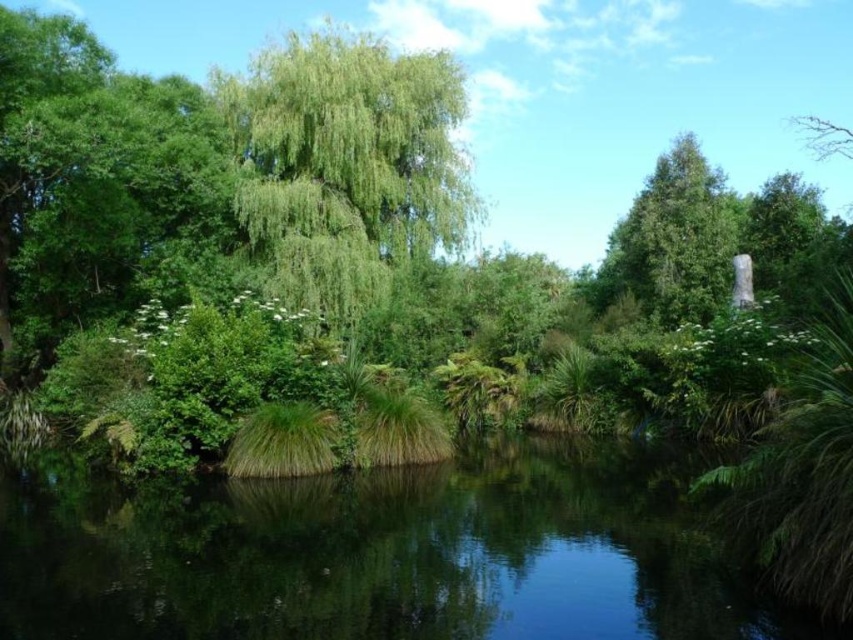
You are a hiker who wants to cross the green grassy lake at center to reach the green matte tree at upper right. If your kayak can travel 10 feet per minute, how many minutes will it take to reach the tree?

The distance between the green grassy lake at center and the green matte tree at upper right is 39.14 feet. Since the kayak travels at 10 feet per minute, it would take approximately 3.914 minutes, which rounds up to about 4 minutes to reach the tree.

You are standing at the edge of the water and want to walk to the green leafy tree at upper center and the green matte tree at upper right. Which tree is closer to you?

The green leafy tree at upper center is closer to you because it is 31.30 feet away from the green matte tree at upper right, meaning the green leafy tree is nearer than the green matte tree.

You are a photographer planning to capture the entire scene in one shot. Given that the green grassy lake at center and the green matte tree at upper right are both in view, which object would appear smaller in your photo?

The green grassy lake at center would appear smaller in the photo because it has a smaller size compared to the green matte tree at upper right.